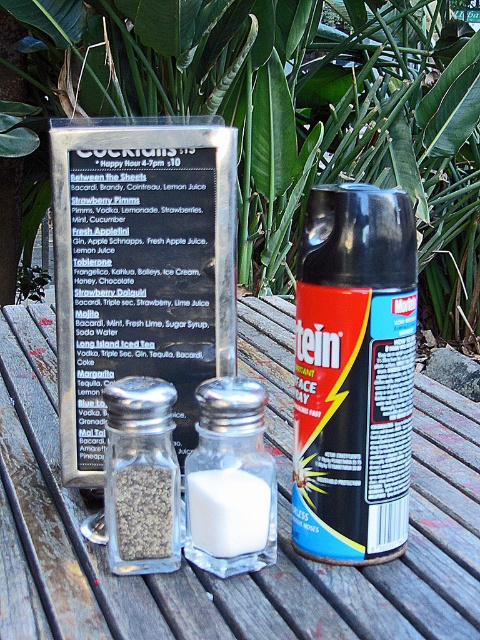
Question: Considering the real-world distances, which object is farthest from the black matte spray can at center?

Choices:
 (A) clear glass salt shaker at center
 (B) black plastic menu at center
 (C) white glass salt shaker at center

Answer: (A)

Question: Which point is closer to the camera?

Choices:
 (A) (155, 321)
 (B) (432, 387)

Answer: (A)

Question: Which is farther from the transparent glass salt and pepper shakers at center?

Choices:
 (A) clear glass salt shaker at center
 (B) black matte spray can at center

Answer: (A)

Question: Can you confirm if black plastic menu at center is thinner than white glass salt shaker at center?

Choices:
 (A) no
 (B) yes

Answer: (A)

Question: Can you confirm if transparent glass salt and pepper shakers at center is smaller than clear glass salt shaker at center?

Choices:
 (A) yes
 (B) no

Answer: (B)

Question: Can you confirm if black matte spray can at center is positioned above clear glass salt shaker at center?

Choices:
 (A) yes
 (B) no

Answer: (A)